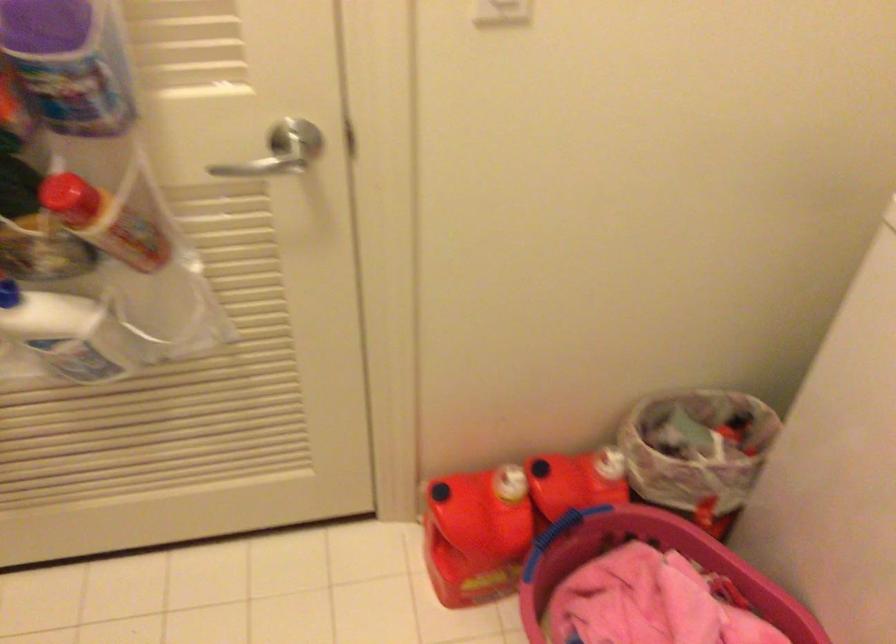
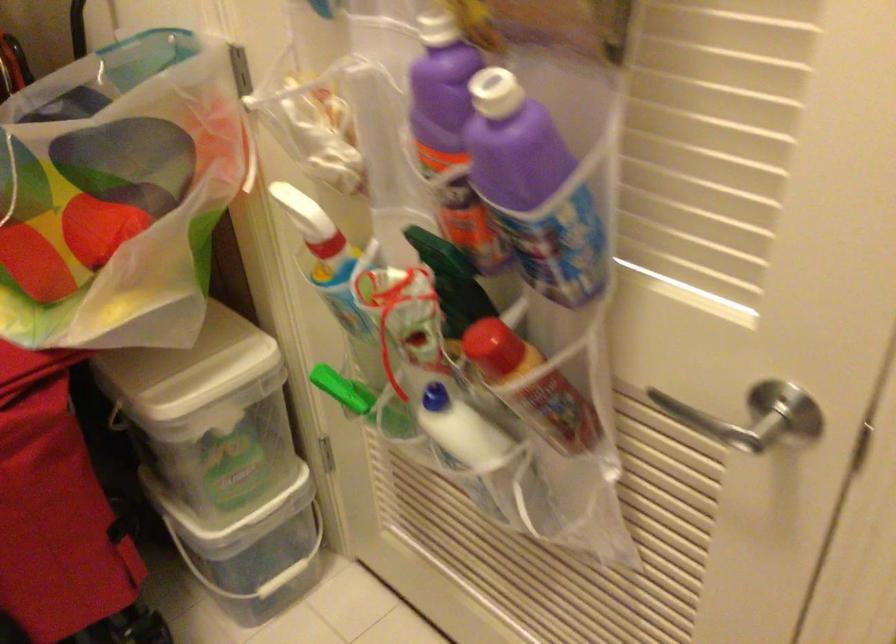
Question: How did the camera likely rotate?

Choices:
 (A) Left
 (B) Right
 (C) Up
 (D) Down

Answer: (A)